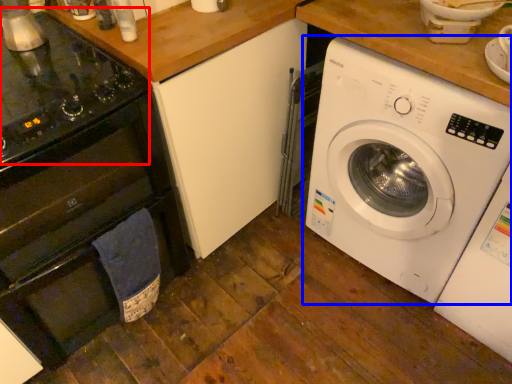
Question: Which object is closer to the camera taking this photo, gas stove (highlighted by a red box) or washing machine (highlighted by a blue box)?

Choices:
 (A) gas stove
 (B) washing machine

Answer: (A)